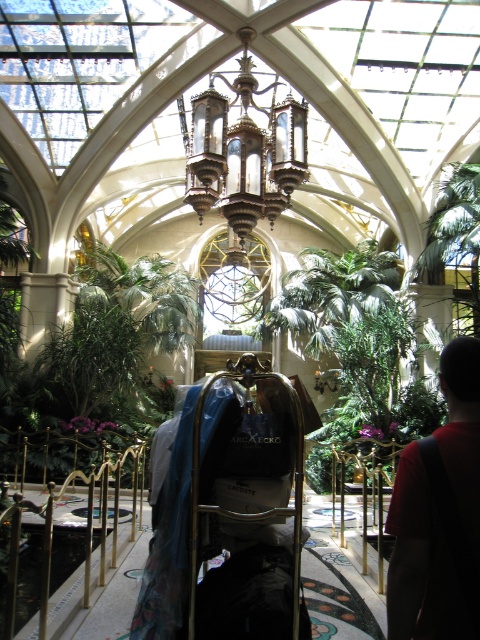
Does metallic gold luggage cart at center lie behind polished brass chandelier at center?

That is False.

Does metallic gold luggage cart at center have a lesser height compared to polished brass chandelier at center?

No, metallic gold luggage cart at center is not shorter than polished brass chandelier at center.

Which is in front, point (207, 541) or point (265, 182)?

Point (207, 541)

At what (x,y) coordinates should I click in order to perform the action: click on metallic gold luggage cart at center. Please return your answer as a coordinate pair (x, y). The height and width of the screenshot is (640, 480). Looking at the image, I should click on (226, 504).

Which of these two, metallic gold luggage cart at center or dark red shirt at lower right, stands taller?

With more height is metallic gold luggage cart at center.

Is metallic gold luggage cart at center wider than dark red shirt at lower right?

Correct, the width of metallic gold luggage cart at center exceeds that of dark red shirt at lower right.

What do you see at coordinates (226, 504) in the screenshot?
I see `metallic gold luggage cart at center` at bounding box center [226, 504].

The image size is (480, 640). I want to click on metallic gold luggage cart at center, so click(226, 504).

Based on the photo, between dark red shirt at lower right and polished brass chandelier at center, which one appears on the left side from the viewer's perspective?

Positioned to the left is polished brass chandelier at center.

Image resolution: width=480 pixels, height=640 pixels. I want to click on dark red shirt at lower right, so [x=421, y=563].